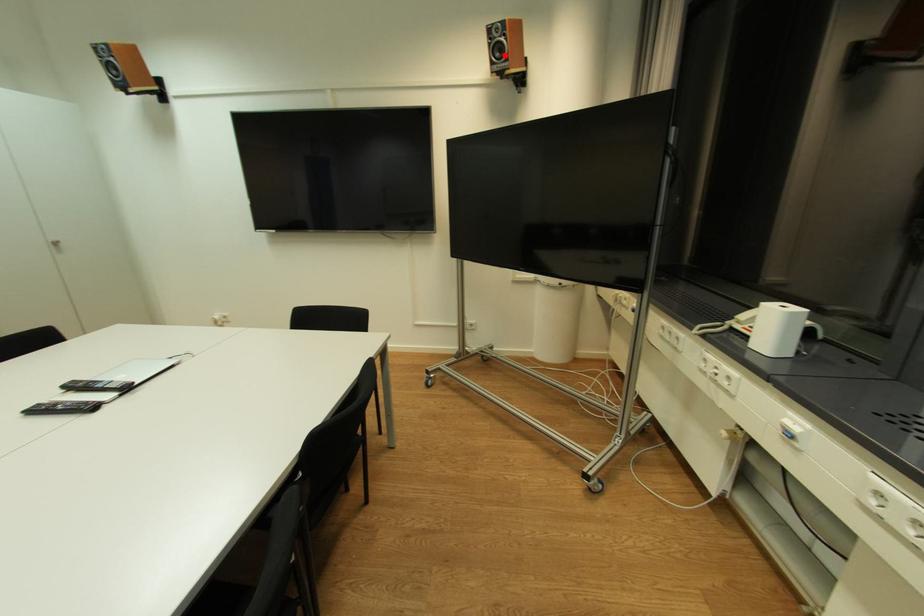
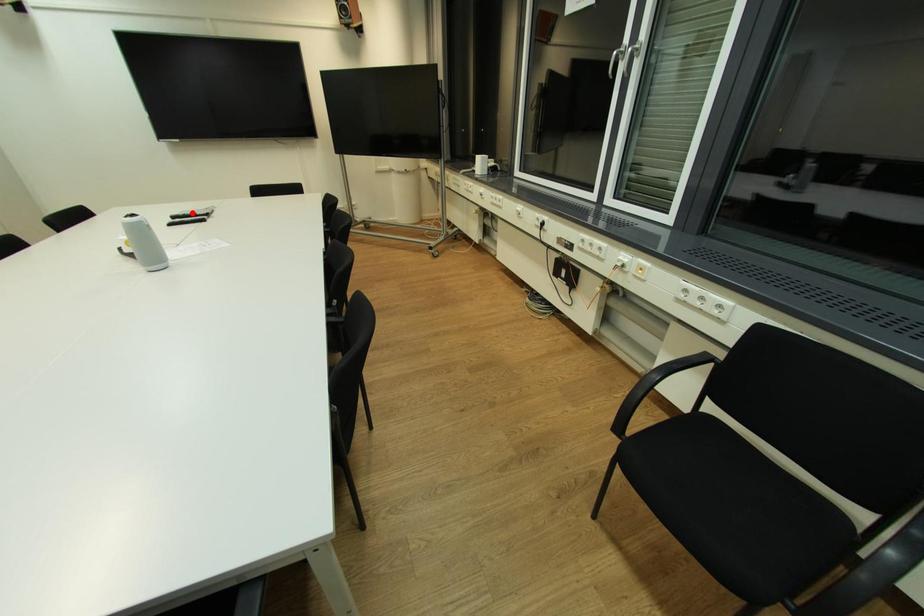
I am providing you with two images of the same scene from different viewpoints. A red point is marked on the first image and another point is marked on the second image. Is the red point in image1 aligned with the point shown in image2?

No